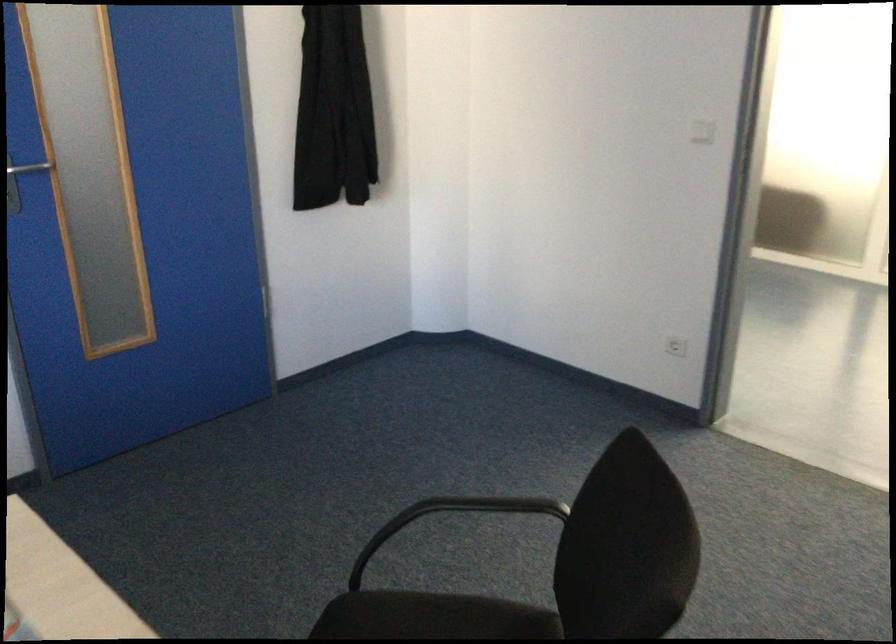
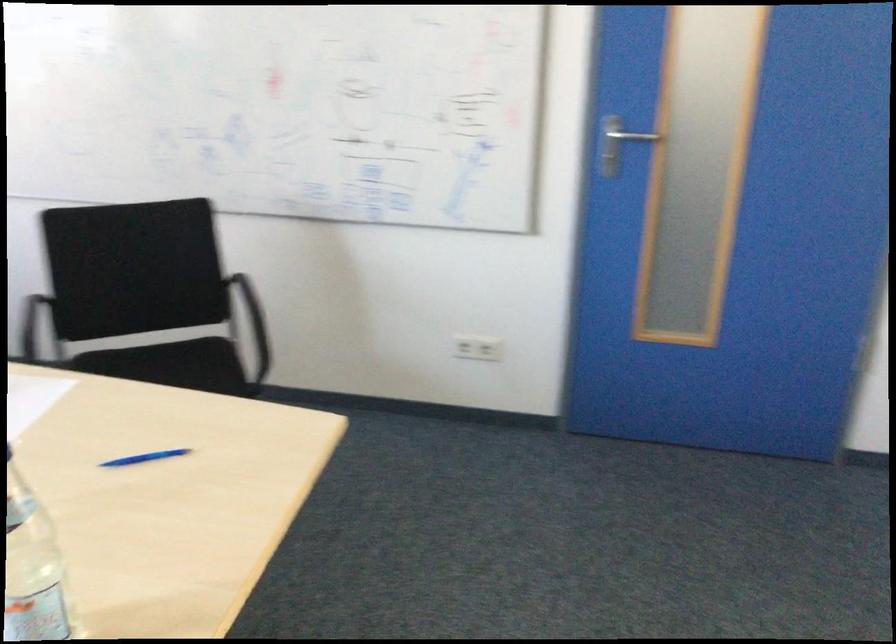
Question: Based on the continuous images, in which direction is the camera rotating? Reply with the corresponding letter.

Choices:
 (A) Left
 (B) Right
 (C) Up
 (D) Down

Answer: (A)